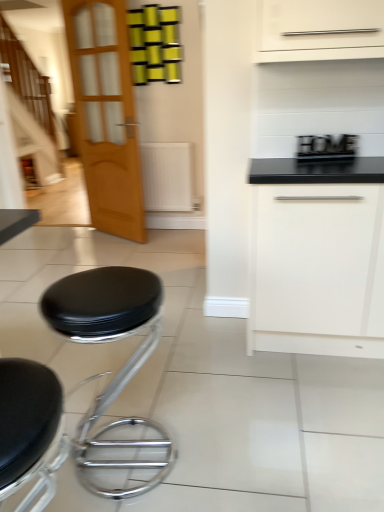
Question: Is black leather stool at lower left, the first stool when ordered from front to back, with wooden staircase at left?

Choices:
 (A) yes
 (B) no

Answer: (B)

Question: Can you confirm if black leather stool at lower left, arranged as the 2th stool when viewed from the back, is smaller than wooden staircase at left?

Choices:
 (A) yes
 (B) no

Answer: (A)

Question: Does black leather stool at lower left, the first stool when ordered from front to back, appear on the left side of wooden staircase at left?

Choices:
 (A) yes
 (B) no

Answer: (B)

Question: Could you tell me if black leather stool at lower left, arranged as the 2th stool when viewed from the back, is facing wooden staircase at left?

Choices:
 (A) no
 (B) yes

Answer: (A)

Question: From a real-world perspective, does black leather stool at lower left, the first stool when ordered from front to back, stand above wooden staircase at left?

Choices:
 (A) yes
 (B) no

Answer: (B)

Question: Is wooden staircase at left inside black leather stool at lower left, the first stool when ordered from front to back?

Choices:
 (A) no
 (B) yes

Answer: (A)

Question: Is black leather stool at lower left, the 1th stool viewed from the back, at the left side of wooden staircase at left?

Choices:
 (A) yes
 (B) no

Answer: (B)

Question: Is black leather stool at lower left, the second stool from the front, closer to camera compared to wooden staircase at left?

Choices:
 (A) no
 (B) yes

Answer: (B)

Question: Is black leather stool at lower left, the 1th stool viewed from the back, not inside wooden staircase at left?

Choices:
 (A) no
 (B) yes

Answer: (B)

Question: Can you confirm if black leather stool at lower left, the 1th stool viewed from the back, is wider than wooden staircase at left?

Choices:
 (A) no
 (B) yes

Answer: (B)

Question: Does black leather stool at lower left, the second stool from the front, have a lesser width compared to wooden staircase at left?

Choices:
 (A) yes
 (B) no

Answer: (B)

Question: Considering the relative sizes of black leather stool at lower left, the second stool from the front, and wooden staircase at left in the image provided, is black leather stool at lower left, the second stool from the front, shorter than wooden staircase at left?

Choices:
 (A) no
 (B) yes

Answer: (B)

Question: From the image's perspective, would you say black leather stool at lower left, the first stool when ordered from front to back, is shown under white matte drawer at center right?

Choices:
 (A) yes
 (B) no

Answer: (A)